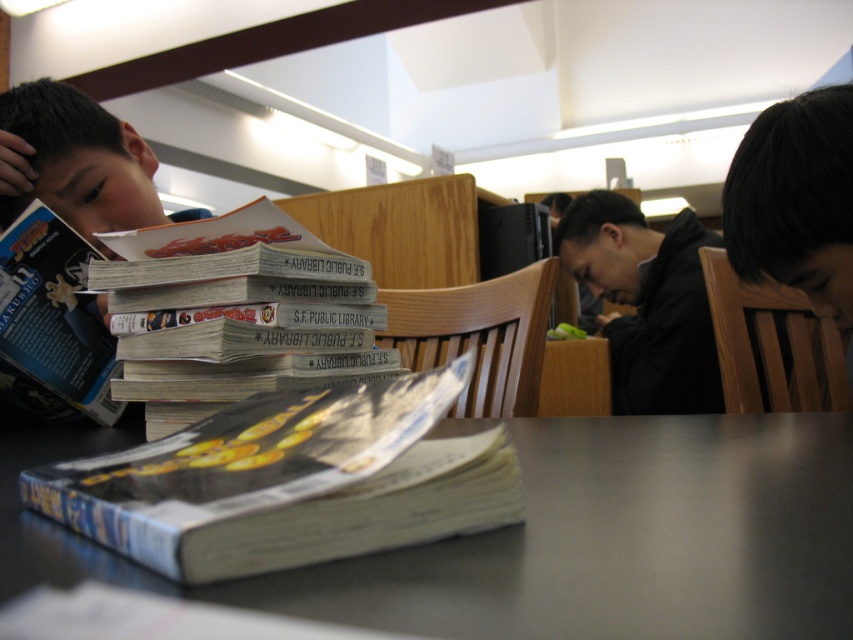
You are standing in the library scene described. There is a point labeled at coordinates (553,538). What object is located at this point?

The point at coordinates (553,538) corresponds to the smooth gray table at lower center.

From the picture: You are a librarian who needs to place a new book on the smooth gray table at lower center. According to the coordinates provided, where exactly should you place the book?

The smooth gray table at lower center is located at point [553,538], so you should place the book there.

You are a librarian organizing books on a shelf. You have to place the white glossy book at center and the matte black book at left. Based on their positions in the image, which book should you place first if you want to arrange them from closest to farthest from the shelf?

The white glossy book at center should be placed first because it is closer to the viewer than the matte black book at left, so in terms of distance from the shelf, it would be the closest.